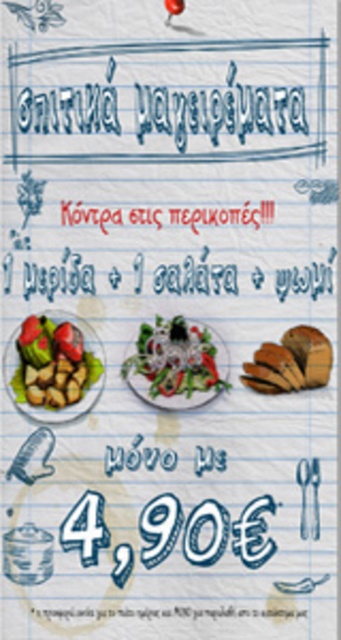
You are looking at the promotional advertisement for the meal deal. Which object is closer to you between the green leafy salad at center and the golden brown bread at center right?

The green leafy salad at center is closer to you because it is further to the viewer than the golden brown bread at center right.

You are looking at the promotional advertisement for a meal deal on a lined notebook paper background. You want to locate the white paper text at center. Where exactly is it positioned?

The white paper text at center is located at point (196, 276).